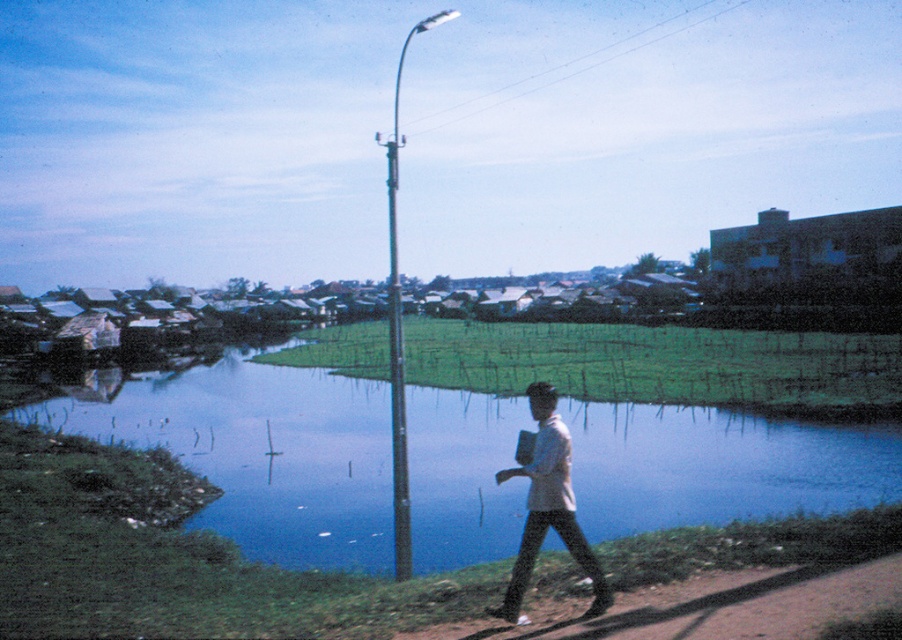
Can you confirm if white fabric shirt at center is thinner than metallic gray pole at center?

Indeed, white fabric shirt at center has a lesser width compared to metallic gray pole at center.

Can you confirm if white fabric shirt at center is positioned below metallic gray pole at center?

Correct, white fabric shirt at center is located below metallic gray pole at center.

Which is behind, point (542, 444) or point (394, 576)?

The point (394, 576) is more distant.

The height and width of the screenshot is (640, 902). In order to click on white fabric shirt at center in this screenshot , I will do `click(548, 506)`.

Is blue water at center positioned before metallic gray pole at center?

Yes, blue water at center is closer to the viewer.

Which is in front, point (428, 529) or point (394, 134)?

Positioned in front is point (428, 529).

Locate an element on the screen. This screenshot has width=902, height=640. blue water at center is located at coordinates (641, 428).

Identify the location of blue water at center. (641, 428).

Is white fabric shirt at center below smooth metallic pole at center?

Indeed, white fabric shirt at center is positioned under smooth metallic pole at center.

Does white fabric shirt at center appear on the right side of smooth metallic pole at center?

Yes, white fabric shirt at center is to the right of smooth metallic pole at center.

Which is in front, point (568, 468) or point (388, 152)?

Point (568, 468) is in front.

Where is `white fabric shirt at center`? white fabric shirt at center is located at coordinates (548, 506).